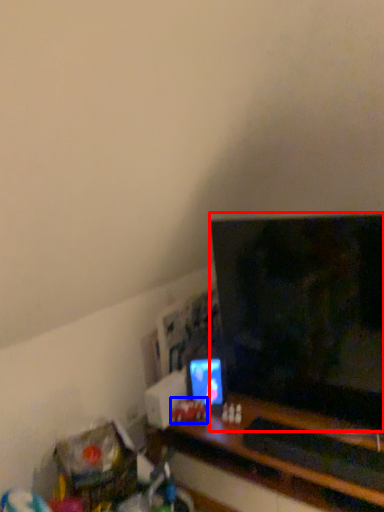
Question: Which object is closer to the camera taking this photo, television (highlighted by a red box) or toy (highlighted by a blue box)?

Choices:
 (A) television
 (B) toy

Answer: (A)